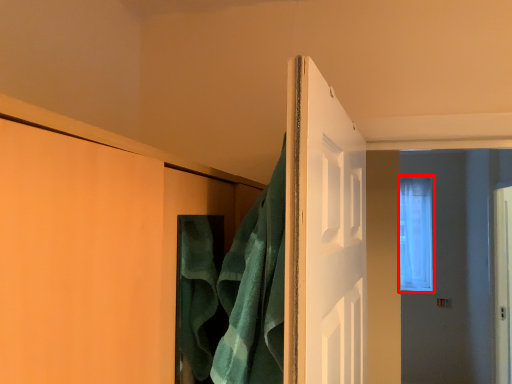
Question: Where is window (annotated by the red box) located in relation to bath towel in the image?

Choices:
 (A) right
 (B) left

Answer: (A)